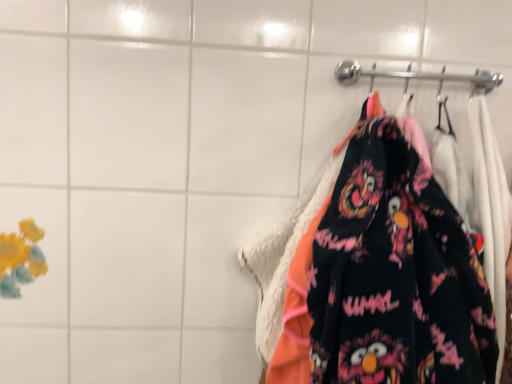
In order to face velvet black dress at right, should I rotate leftwards or rightwards?

To face it directly, rotate right by 20.331 degrees.

What do you see at coordinates (373, 272) in the screenshot? I see `velvet black dress at right` at bounding box center [373, 272].

Where is `velvet black dress at right`? velvet black dress at right is located at coordinates (373, 272).

Image resolution: width=512 pixels, height=384 pixels. Identify the location of velvet black dress at right. (373, 272).